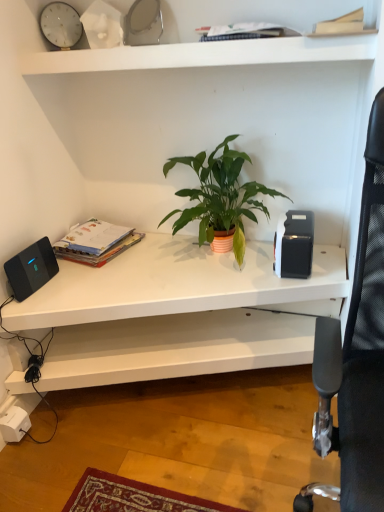
Locate an element on the screen. free space between matte paperbacks at left, the second paperback book in the right-to-left sequence, and black plastic toaster at right is located at coordinates click(x=185, y=258).